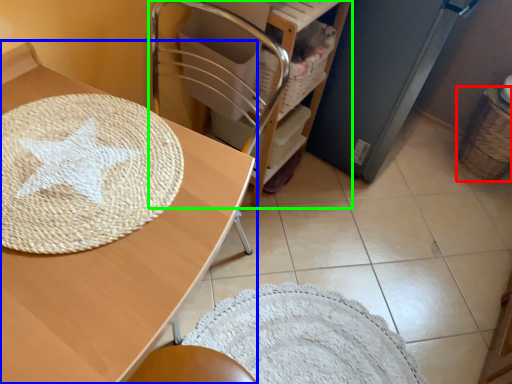
Question: Based on their relative distances, which object is farther from basket (highlighted by a red box)? Choose from table (highlighted by a blue box) and furniture (highlighted by a green box).

Choices:
 (A) table
 (B) furniture

Answer: (A)